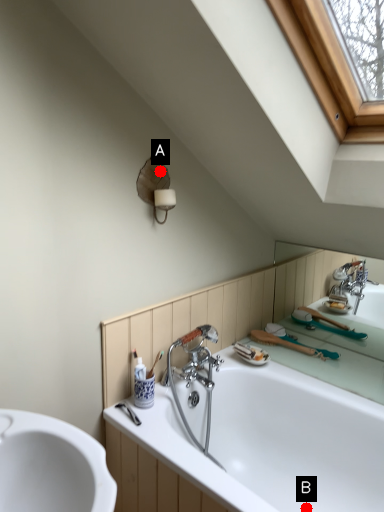
Question: Two points are circled on the image, labeled by A and B beside each circle. Which point is farther to the camera?

Choices:
 (A) A is further
 (B) B is further

Answer: (B)